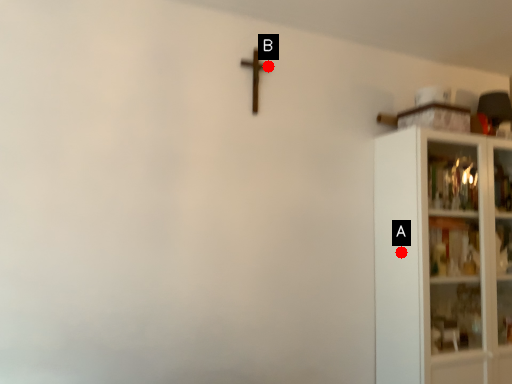
Question: Two points are circled on the image, labeled by A and B beside each circle. Which point is farther to the camera?

Choices:
 (A) A is further
 (B) B is further

Answer: (B)